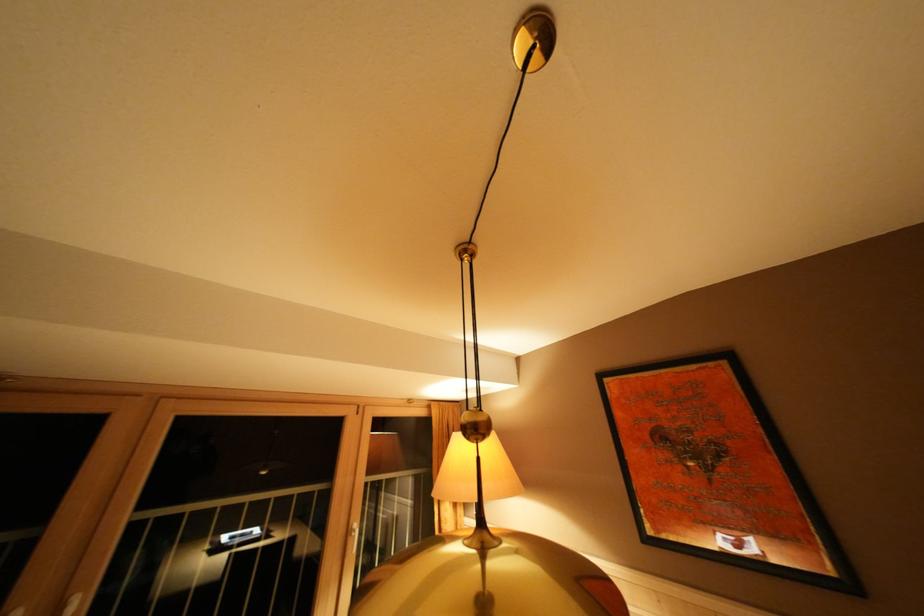
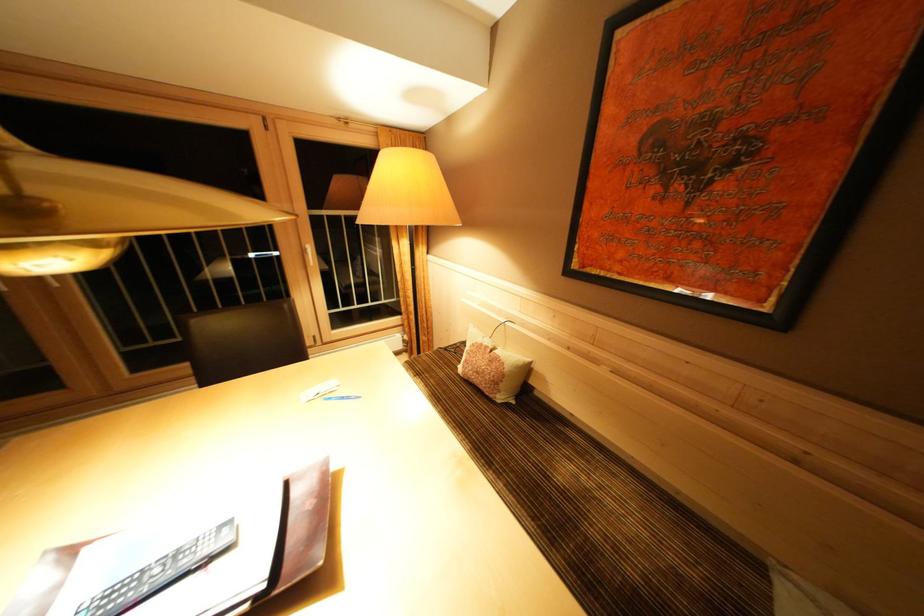
Question: How did the camera likely rotate?

Choices:
 (A) Left
 (B) Right
 (C) Up
 (D) Down

Answer: (D)